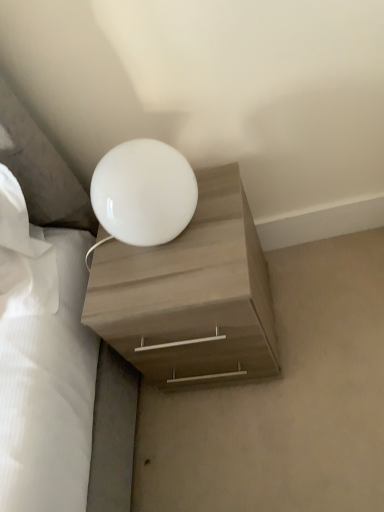
Locate an element on the screen. Image resolution: width=384 pixels, height=512 pixels. vacant space to the right of white glossy sphere at upper center is located at coordinates (221, 201).